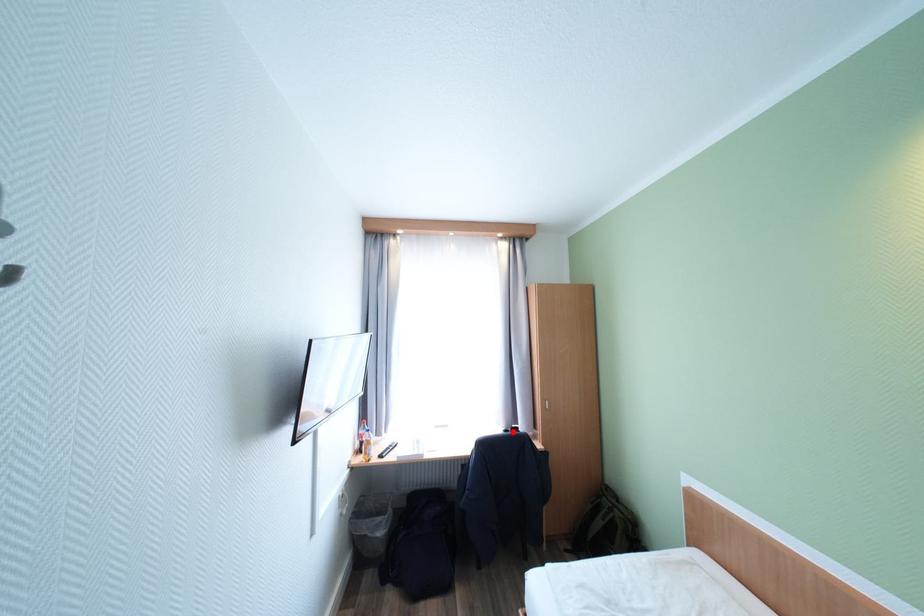
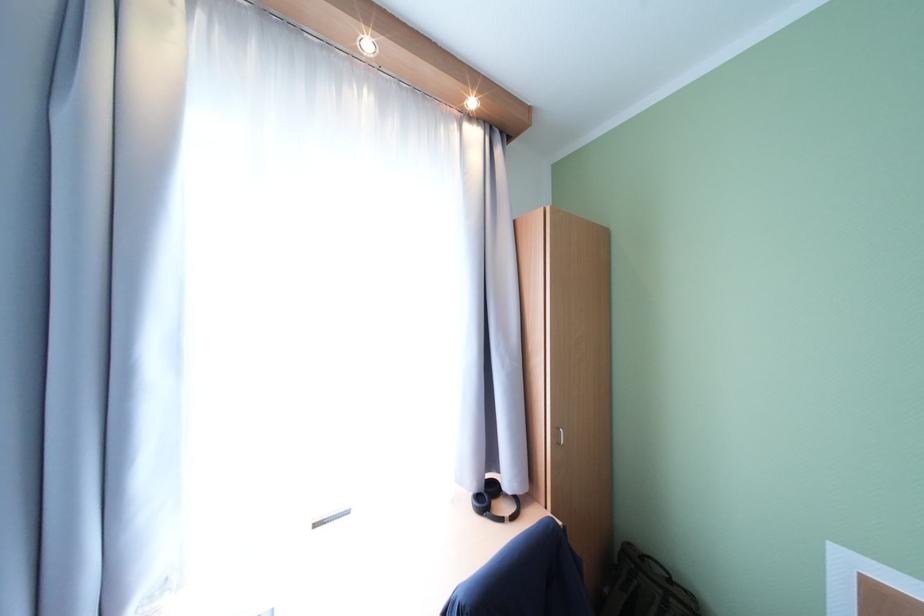
Question: A red point is marked in image1. In image2, is the corresponding 3D point closer to the camera or farther? Reply with the corresponding letter.

Choices:
 (A) The corresponding 3D point is closer.
 (B) The corresponding 3D point is farther.

Answer: (A)